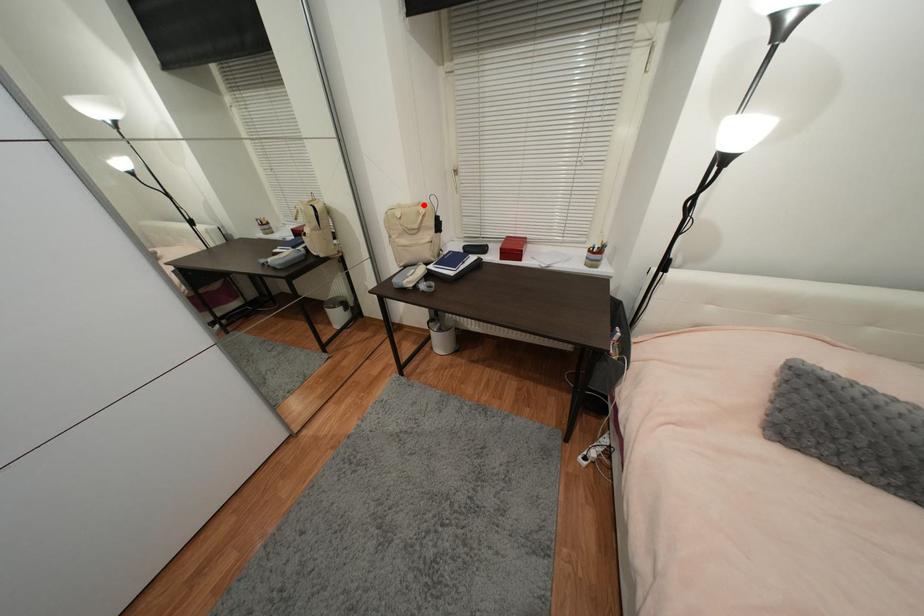
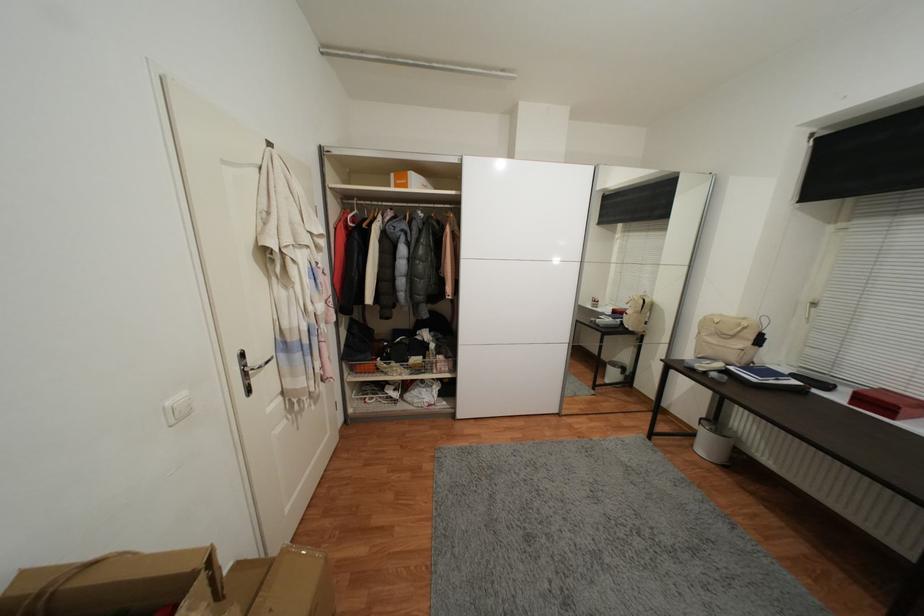
Question: A red point is marked in image1. In image2, is the corresponding 3D point closer to the camera or farther? Reply with the corresponding letter.

Choices:
 (A) The corresponding 3D point is closer.
 (B) The corresponding 3D point is farther.

Answer: (B)